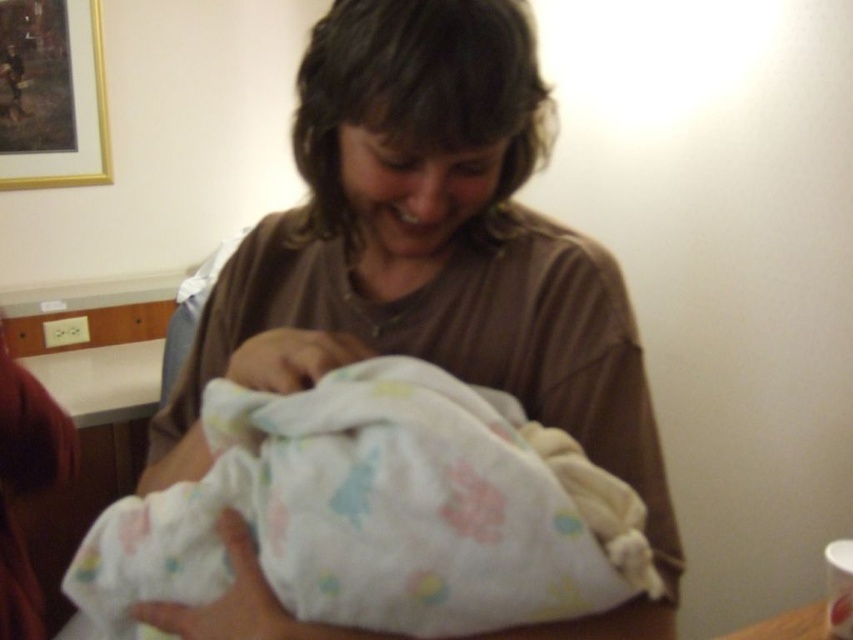
Which is below, white soft cloth at center or fluffy white blanket at center?

fluffy white blanket at center is lower down.

Which of these two, white soft cloth at center or fluffy white blanket at center, stands taller?

Standing taller between the two is white soft cloth at center.

This screenshot has height=640, width=853. What do you see at coordinates (433, 259) in the screenshot? I see `white soft cloth at center` at bounding box center [433, 259].

Find the location of `white soft cloth at center`. white soft cloth at center is located at coordinates (433, 259).